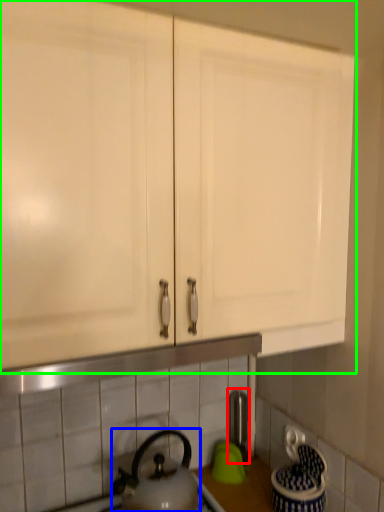
Question: Which object is positioned farthest from faucet (highlighted by a red box)? Select from kettle (highlighted by a blue box) and cabinetry (highlighted by a green box).

Choices:
 (A) kettle
 (B) cabinetry

Answer: (B)